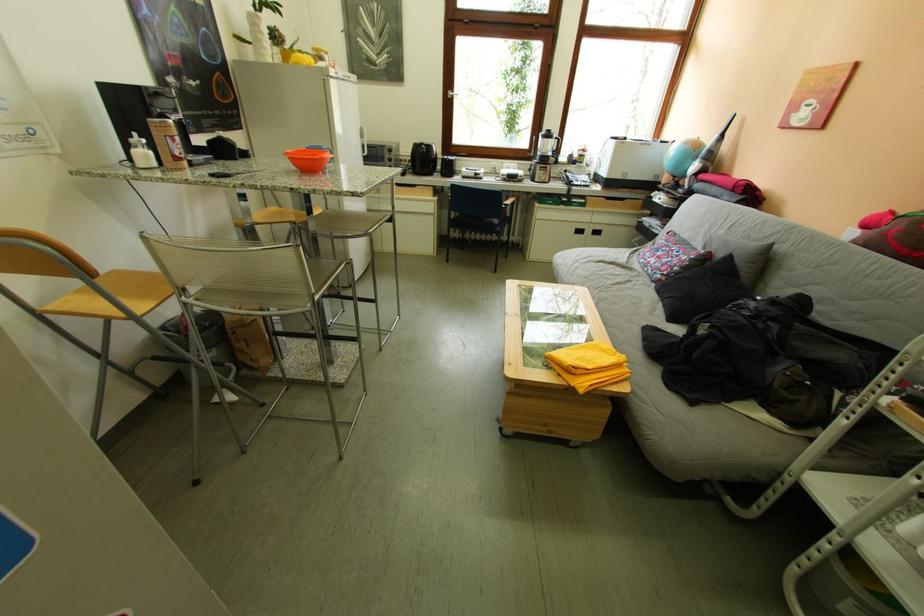
The width and height of the screenshot is (924, 616). What do you see at coordinates (543, 156) in the screenshot?
I see `the electric kettle handle` at bounding box center [543, 156].